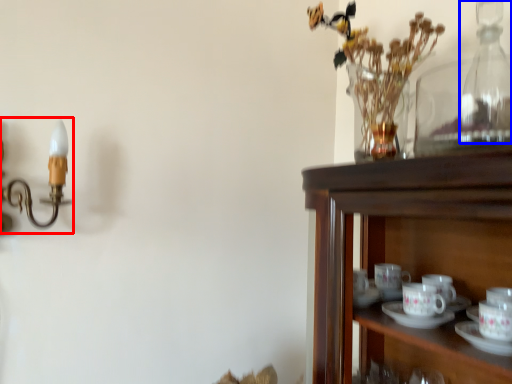
Question: Which object appears closest to the camera in this image, candle holder (highlighted by a red box) or bottle (highlighted by a blue box)?

Choices:
 (A) candle holder
 (B) bottle

Answer: (A)